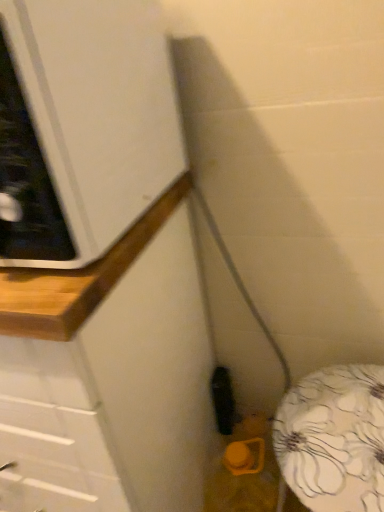
Question: Is white glossy cabinet at upper left taller or shorter than wooden counter at lower left?

Choices:
 (A) tall
 (B) short

Answer: (B)

Question: Based on their sizes in the image, would you say white glossy cabinet at upper left is bigger or smaller than wooden counter at lower left?

Choices:
 (A) small
 (B) big

Answer: (A)

Question: Is white glossy cabinet at upper left to the left or to the right of wooden counter at lower left in the image?

Choices:
 (A) right
 (B) left

Answer: (B)

Question: Does point (192, 464) appear closer or farther from the camera than point (173, 111)?

Choices:
 (A) closer
 (B) farther

Answer: (B)

Question: Is wooden counter at lower left wider or thinner than white glossy cabinet at upper left?

Choices:
 (A) wide
 (B) thin

Answer: (A)

Question: Considering the positions of wooden counter at lower left and white glossy cabinet at upper left in the image, is wooden counter at lower left taller or shorter than white glossy cabinet at upper left?

Choices:
 (A) short
 (B) tall

Answer: (B)

Question: Is wooden counter at lower left spatially inside white glossy cabinet at upper left, or outside of it?

Choices:
 (A) inside
 (B) outside

Answer: (B)